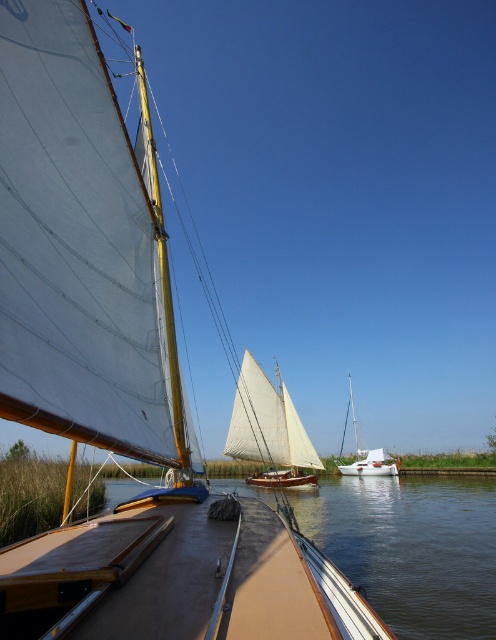
You are a sailor planning to navigate through the canal. You see the white canvas sailboat at center and the white matte sailboat at center ahead. Which boat should you avoid to ensure your vessel has enough space to pass safely?

You should avoid the white matte sailboat at center because it is wider than the white canvas sailboat at center, which is thinner. Passing around the thinner boat would provide more space for your vessel to maneuver safely.

What are the coordinates of the white canvas sailboat at center?

The white canvas sailboat at center is located at coordinates point (268, 428).